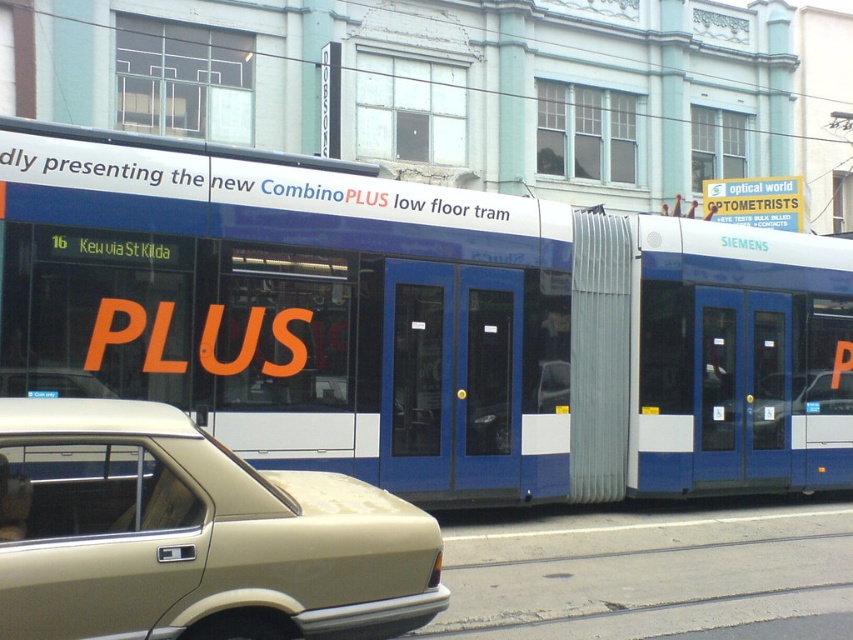
You are a pedestrian standing on the sidewalk and see the white matte bus at center and the beige matte sedan at lower left in the image. Which vehicle is closer to you?

The white matte bus at center is closer to you because it is positioned over the beige matte sedan at lower left, indicating it is in front of the sedan in the scene.

Consider the image. You are a pedestrian standing at the crosswalk and see the white matte bus at center and the beige matte sedan at lower left. Which vehicle is closer to the right side of the crosswalk?

The white matte bus at center is closer to the right side of the crosswalk because it is positioned to the right of the beige matte sedan at lower left.

Based on the scene description, where is the white matte bus at center located in the image?

The white matte bus at center is located at point (422,323) in the image.